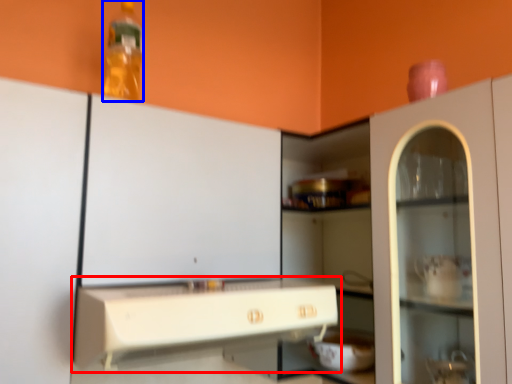
Question: Among these objects, which one is farthest to the camera, countertop (highlighted by a red box) or bottle (highlighted by a blue box)?

Choices:
 (A) countertop
 (B) bottle

Answer: (B)